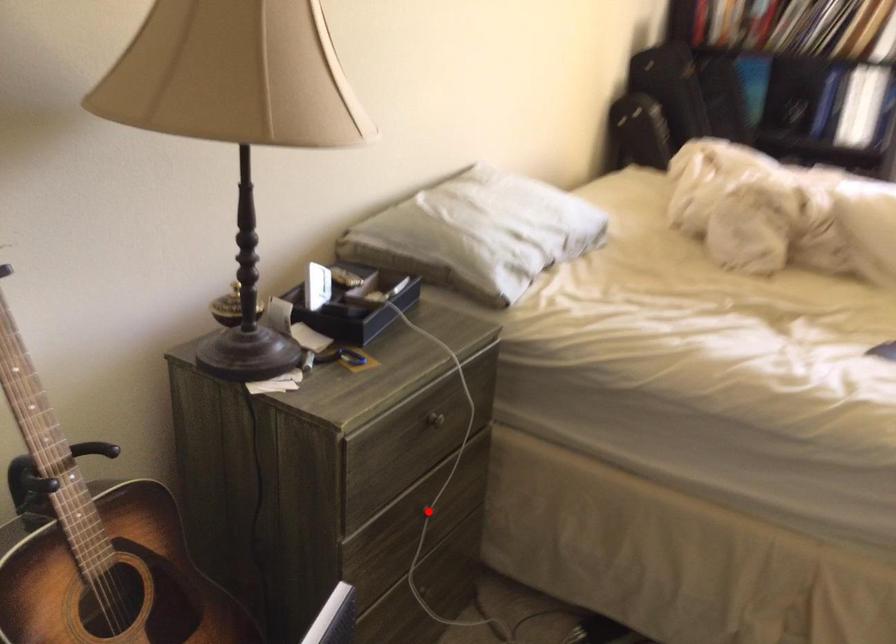
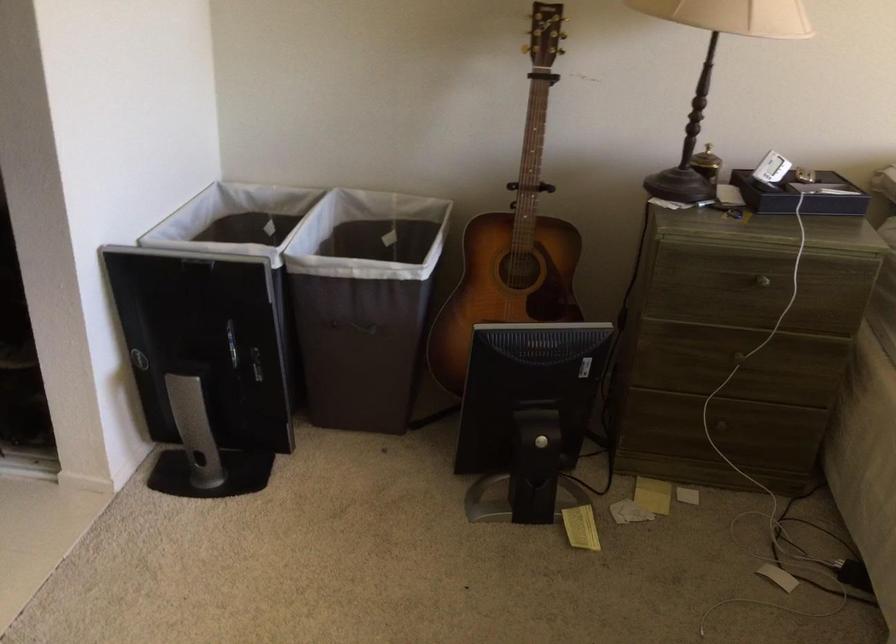
Locate, in the second image, the point that corresponds to the highlighted location in the first image.

(738, 357)